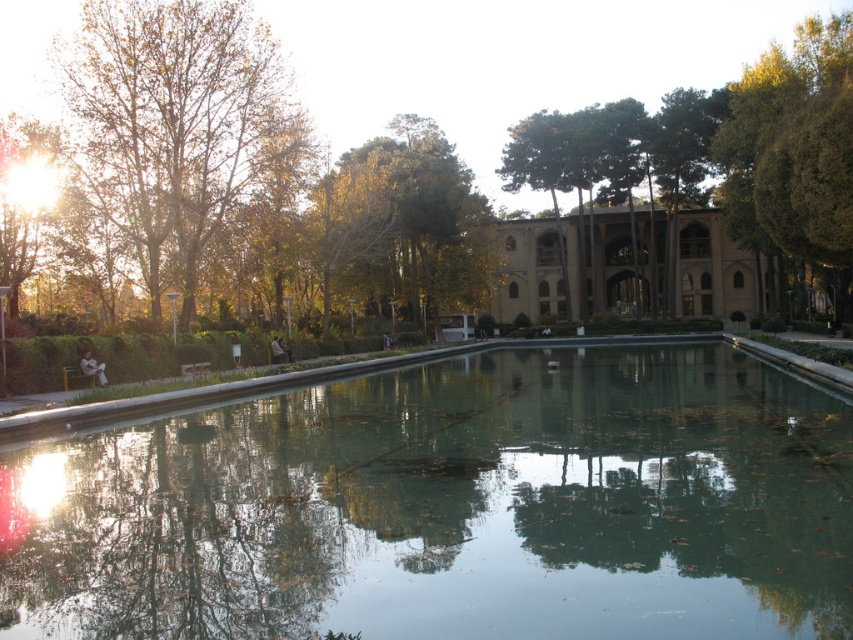
You are standing at the edge of the pool and want to know where the green reflective water at center is positioned relative to your current location. Can you determine its coordinates?

The green reflective water at center is located at coordinates point (451, 508).

You are planning to place a small statue on the green reflective water at center. However, the statue requires a base that must be taller than the beige stone palace at center. Is this feasible?

The green reflective water at center is shorter than the beige stone palace at center. Since the statue base needs to be taller than the palace, it would not be feasible as the water cannot support such a tall structure.

You are standing at the edge of the reflecting pool and want to take a photo of both the green leafy tree at center and the beige stone palace at center. Which object will appear higher in your camera viewfinder?

The green leafy tree at center will appear higher in the camera viewfinder because it is positioned above the beige stone palace at center.